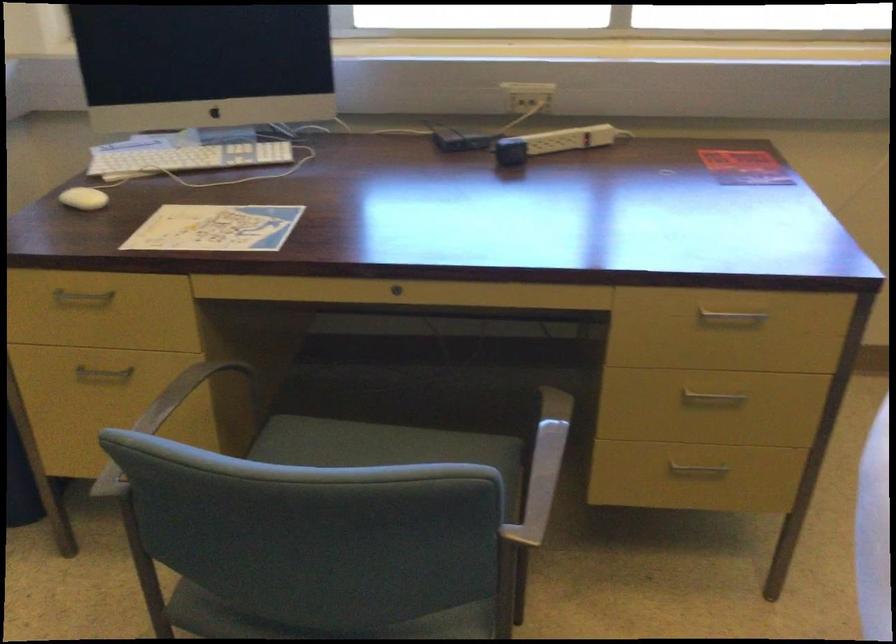
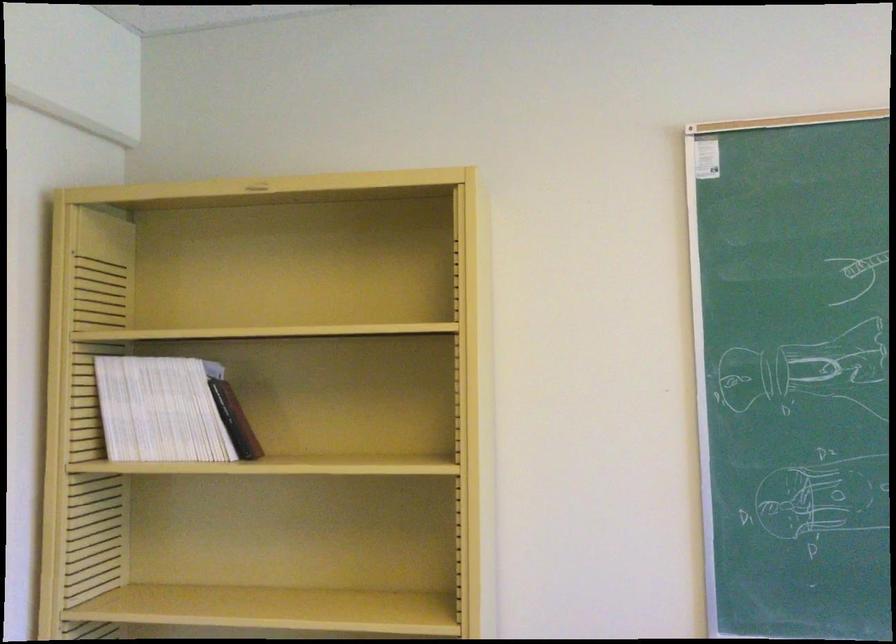
Question: Based on the continuous images, in which direction is the camera rotating? Reply with the corresponding letter.

Choices:
 (A) Left
 (B) Right
 (C) Up
 (D) Down

Answer: (A)